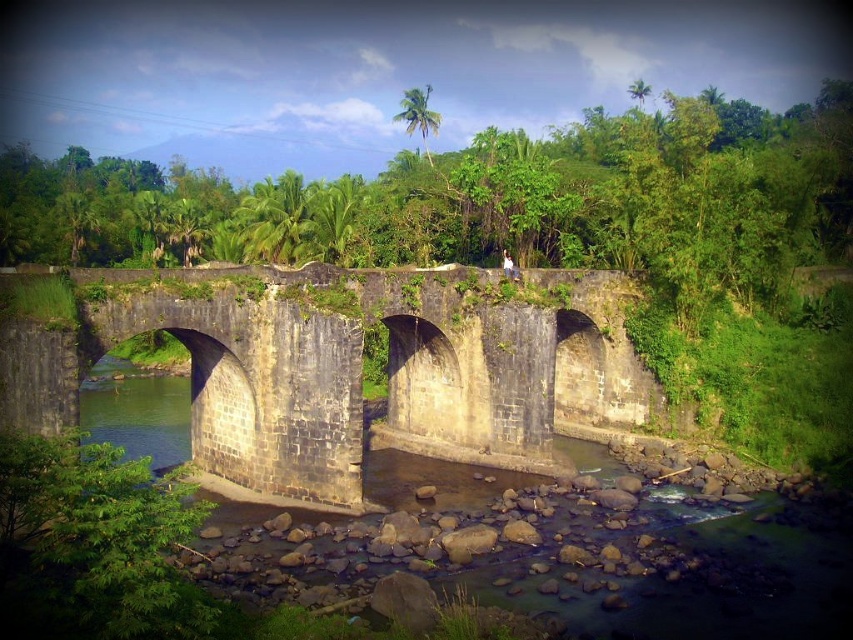
You are a hiker who wants to cross the stone bridge at center. You notice green leafy vegetation at center growing above the bridge. Is the vegetation blocking your path?

The green leafy vegetation at center is positioned over the stone bridge at center, so it may block parts of the path but does not fully obstruct crossing the bridge.

You are an explorer trying to cross the stone bridge at center. You notice green leafy vegetation at center nearby. Which object is wider from an observer standing in front of them?

The green leafy vegetation at center is wider than the stone bridge at center.

You are standing at point (345,404) and want to walk to the stone bridge in the scene. Is the point (825,317) blocking your path?

Point (825,317) is behind point (345,404), so it is not blocking your path to the stone bridge.